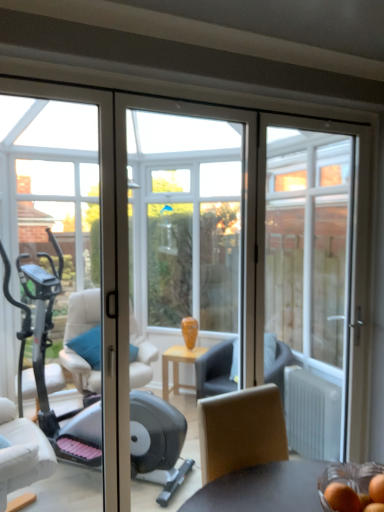
This screenshot has width=384, height=512. Identify the location of empty space that is ontop of transparent glass door at right (from a real-world perspective). (329, 118).